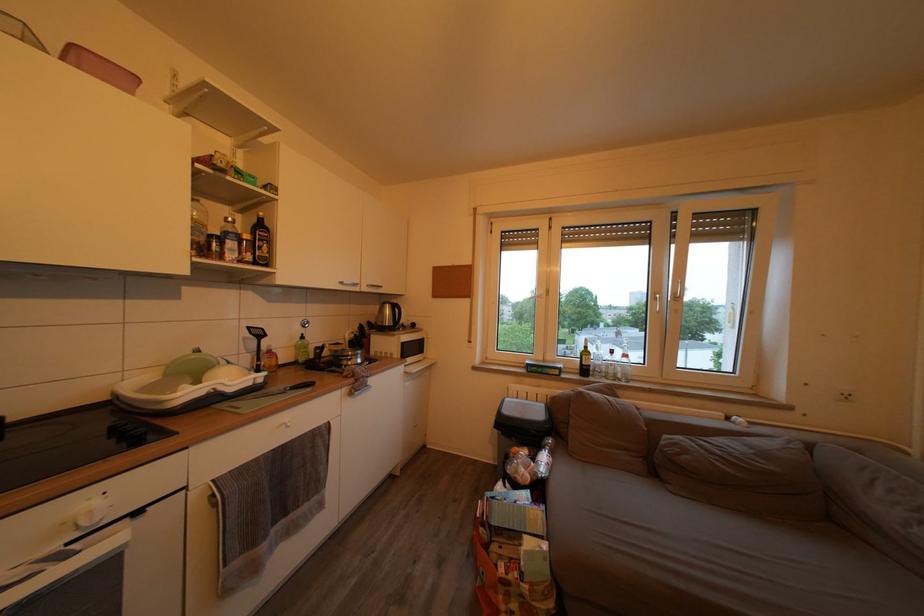
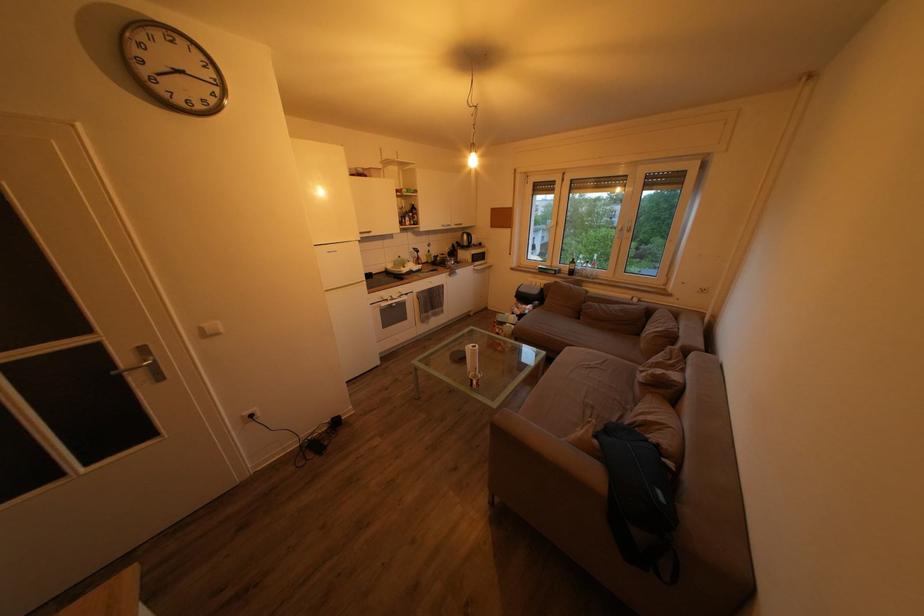
Where in the second image is the point corresponding to (x=372, y=294) from the first image?

(462, 233)